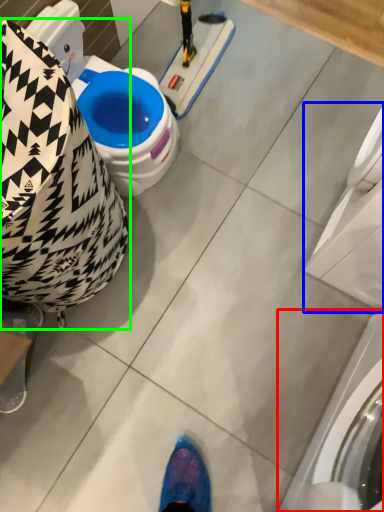
Question: Considering the real-world distances, which object is farthest from washing machine (highlighted by a red box)? washing machine (highlighted by a blue box) or bean bag chair (highlighted by a green box)?

Choices:
 (A) washing machine
 (B) bean bag chair

Answer: (B)